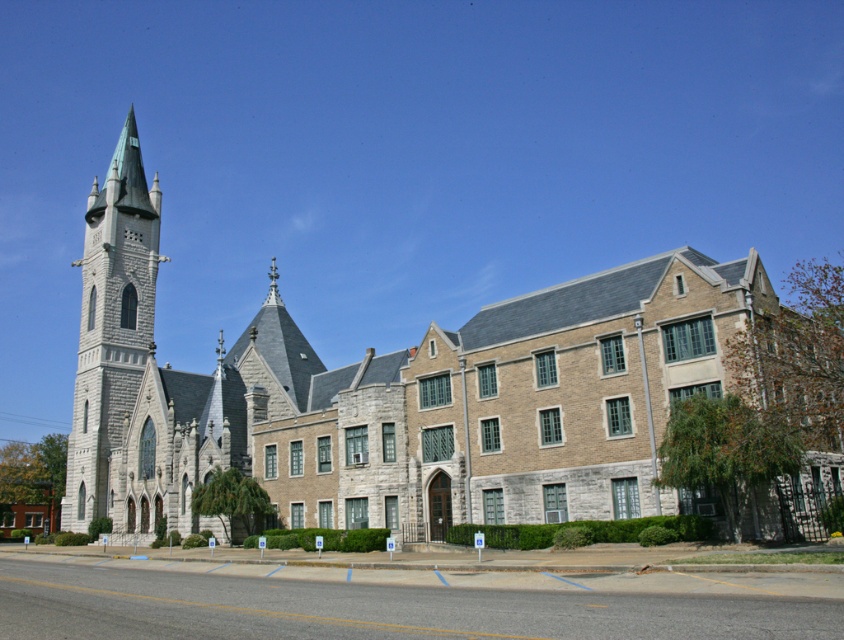
Does gray stone church at left have a greater height compared to gray stone tower at left?

Incorrect, gray stone church at left's height is not larger of gray stone tower at left's.

Does gray stone church at left appear on the right side of gray stone tower at left?

Yes, gray stone church at left is to the right of gray stone tower at left.

Image resolution: width=844 pixels, height=640 pixels. Describe the element at coordinates (391, 394) in the screenshot. I see `gray stone church at left` at that location.

The width and height of the screenshot is (844, 640). In order to click on gray stone church at left in this screenshot , I will do `click(391, 394)`.